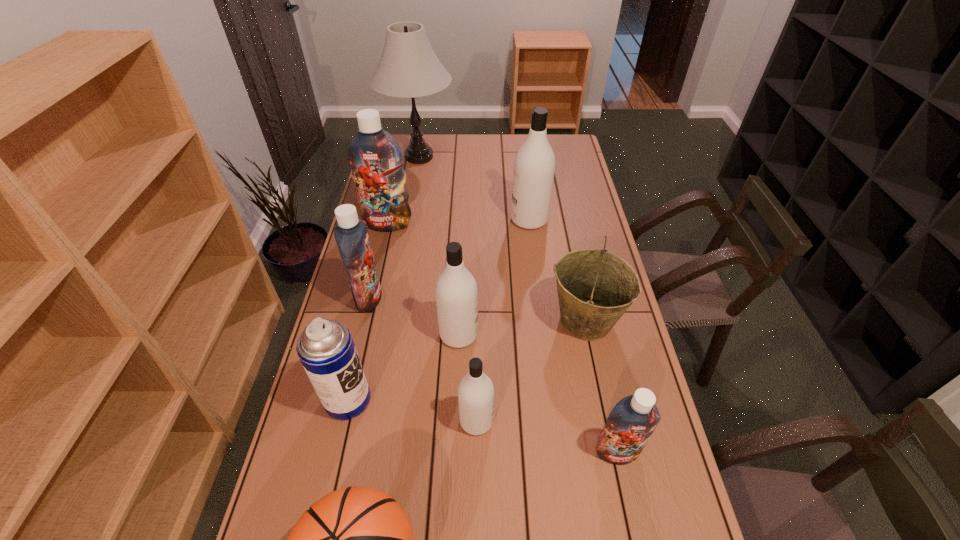
The width and height of the screenshot is (960, 540). In order to click on blue aerosol can in this screenshot , I will do `click(326, 349)`.

This screenshot has width=960, height=540. Identify the location of the fifth farthest shampoo. (476, 393).

This screenshot has width=960, height=540. Identify the location of the smallest white shampoo. (476, 393).

The height and width of the screenshot is (540, 960). I want to click on the ninth farthest object, so click(x=630, y=424).

Identify the location of the nearest shampoo. (630, 424).

Identify the location of blank space located 0.250m on the right of the black lamp. The height and width of the screenshot is (540, 960). (509, 157).

You are a GUI agent. You are given a task and a screenshot of the screen. Output one action in this format:
    pyautogui.click(x=<x>, y=<y>)
    Task: Click on the vacant space located on the front-facing side of the farthest white shampoo
    The image size is (960, 540).
    Given the screenshot: What is the action you would take?
    pyautogui.click(x=491, y=220)

This screenshot has width=960, height=540. Identify the location of vacant region located on the front-facing side of the farthest white shampoo. (434, 220).

Image resolution: width=960 pixels, height=540 pixels. In order to click on free space located on the front-facing side of the farthest white shampoo in this screenshot , I will do `click(440, 220)`.

Where is `blank space located on the front label of the biggest blue shampoo`? The image size is (960, 540). blank space located on the front label of the biggest blue shampoo is located at coordinates (369, 309).